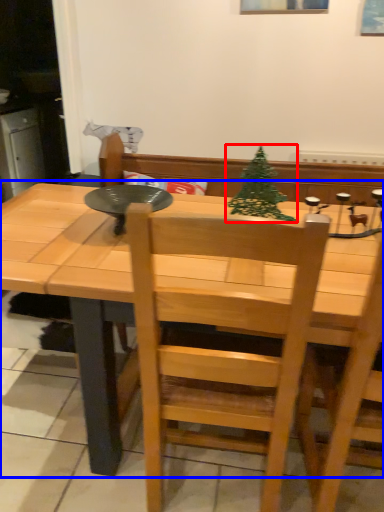
Question: Which object appears closest to the camera in this image, christmas tree (highlighted by a red box) or table (highlighted by a blue box)?

Choices:
 (A) christmas tree
 (B) table

Answer: (B)